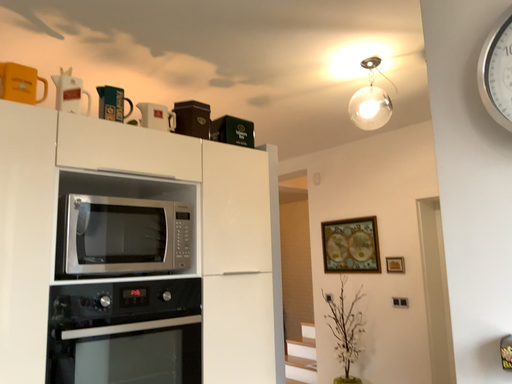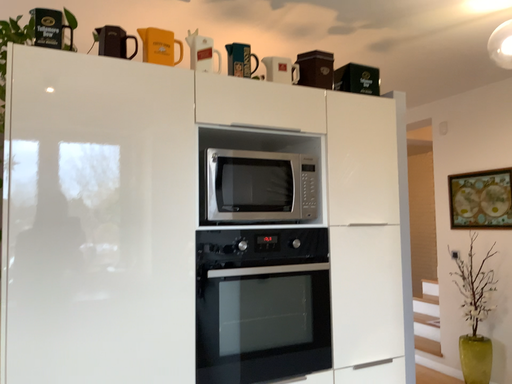
Question: Which way did the camera rotate in the video?

Choices:
 (A) rotated right
 (B) rotated left

Answer: (B)